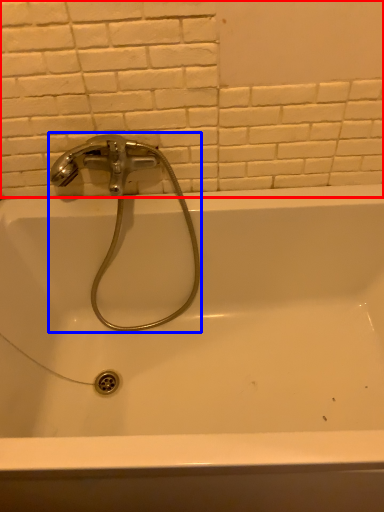
Question: Which object appears closest to the camera in this image, ceramic tile (highlighted by a red box) or tap (highlighted by a blue box)?

Choices:
 (A) ceramic tile
 (B) tap

Answer: (A)